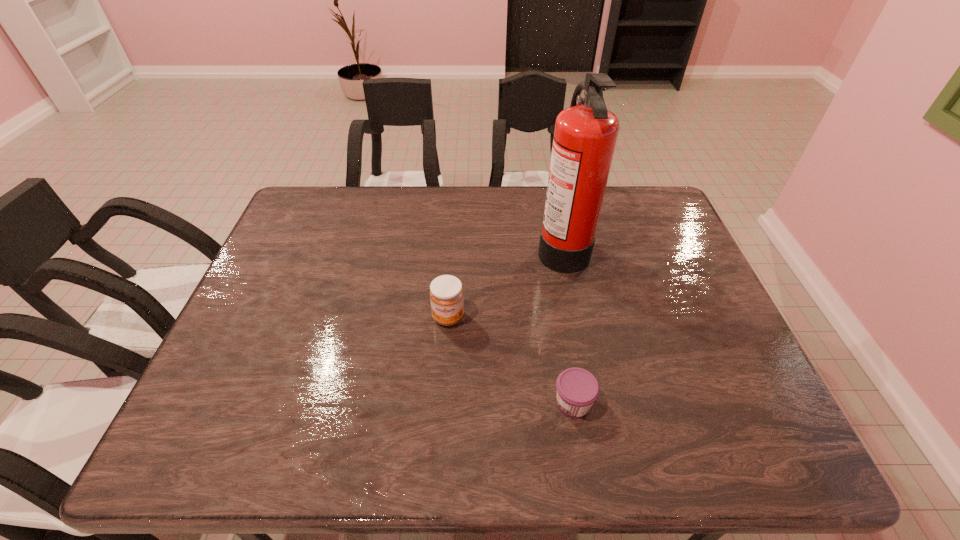
At what (x,y) coordinates should I click in order to perform the action: click on unoccupied position between the nearer jam and the fire extinguisher. Please return your answer as a coordinate pair (x, y). The height and width of the screenshot is (540, 960). Looking at the image, I should click on (567, 325).

Find the location of a particular element. Image resolution: width=960 pixels, height=540 pixels. the closest object relative to the farthest object is located at coordinates (446, 293).

The width and height of the screenshot is (960, 540). In order to click on object that is the second closest to the leftmost object in this screenshot , I will do `click(577, 389)`.

The image size is (960, 540). I want to click on vacant area in the image that satisfies the following two spatial constraints: 1. on the front-facing side of the tallest object; 2. on the front label of the left jam, so point(577,317).

Find the location of `free space in the image that satisfies the following two spatial constraints: 1. on the front-facing side of the tallest object; 2. on the front label of the second shortest object`. free space in the image that satisfies the following two spatial constraints: 1. on the front-facing side of the tallest object; 2. on the front label of the second shortest object is located at coordinates (577, 317).

You are a GUI agent. You are given a task and a screenshot of the screen. Output one action in this format:
    pyautogui.click(x=<x>, y=<y>)
    Task: Click on the free region that satisfies the following two spatial constraints: 1. on the front-facing side of the fire extinguisher; 2. on the front label of the farther jam
    This screenshot has height=540, width=960.
    Given the screenshot: What is the action you would take?
    pyautogui.click(x=577, y=317)

The width and height of the screenshot is (960, 540). I want to click on free space that satisfies the following two spatial constraints: 1. on the front-facing side of the fire extinguisher; 2. on the front label of the second farthest object, so click(577, 317).